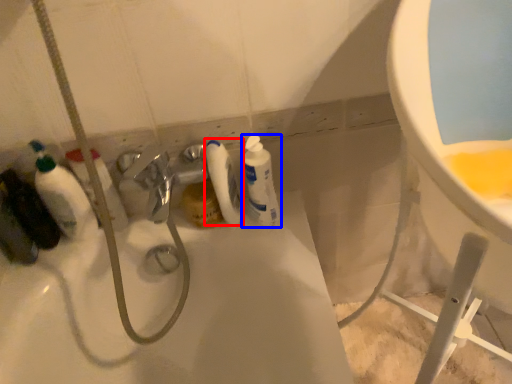
Question: Which object appears closest to the camera in this image, cleaning product (highlighted by a red box) or cleaning product (highlighted by a blue box)?

Choices:
 (A) cleaning product
 (B) cleaning product

Answer: (B)